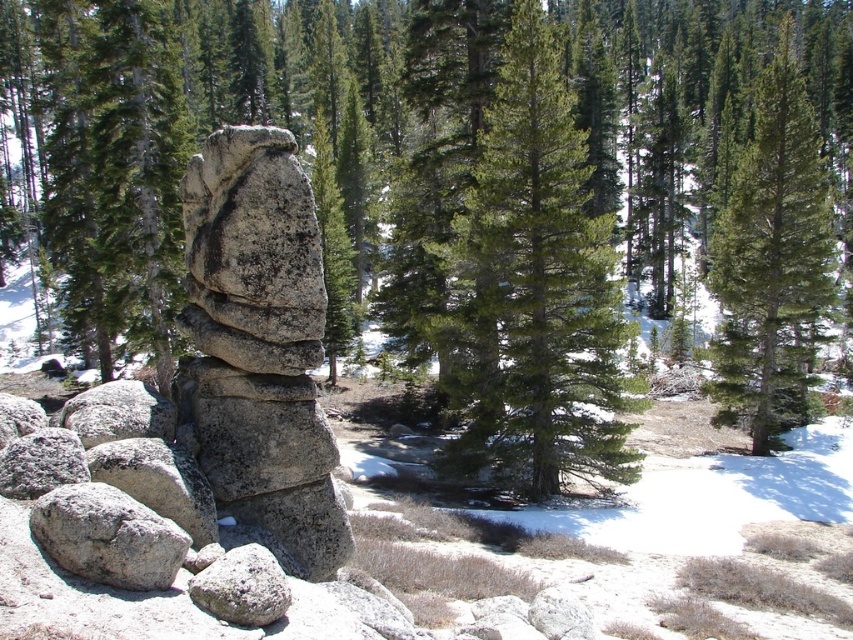
Can you confirm if green matte tree at center is shorter than green matte tree at upper right?

Indeed, green matte tree at center has a lesser height compared to green matte tree at upper right.

How far apart are green matte tree at center and green matte tree at upper right?

A distance of 8.82 meters exists between green matte tree at center and green matte tree at upper right.

This screenshot has width=853, height=640. What do you see at coordinates (534, 289) in the screenshot?
I see `green matte tree at center` at bounding box center [534, 289].

You are a GUI agent. You are given a task and a screenshot of the screen. Output one action in this format:
    pyautogui.click(x=<x>, y=<y>)
    Task: Click on the green matte tree at center
    The width and height of the screenshot is (853, 640).
    Given the screenshot: What is the action you would take?
    pyautogui.click(x=534, y=289)

Who is more forward, (x=236, y=432) or (x=790, y=195)?

Positioned in front is point (x=236, y=432).

What do you see at coordinates (260, 342) in the screenshot? Image resolution: width=853 pixels, height=640 pixels. I see `gray rough rock at center` at bounding box center [260, 342].

Image resolution: width=853 pixels, height=640 pixels. I want to click on gray rough rock at center, so click(x=260, y=342).

Can you confirm if green matte tree at center is positioned below gray rough rock at center?

No, green matte tree at center is not below gray rough rock at center.

This screenshot has width=853, height=640. I want to click on green matte tree at center, so (x=534, y=289).

Consider the image. Who is more distant from viewer, (608, 316) or (233, 477)?

The point (608, 316) is behind.

The image size is (853, 640). Identify the location of green matte tree at center. click(534, 289).